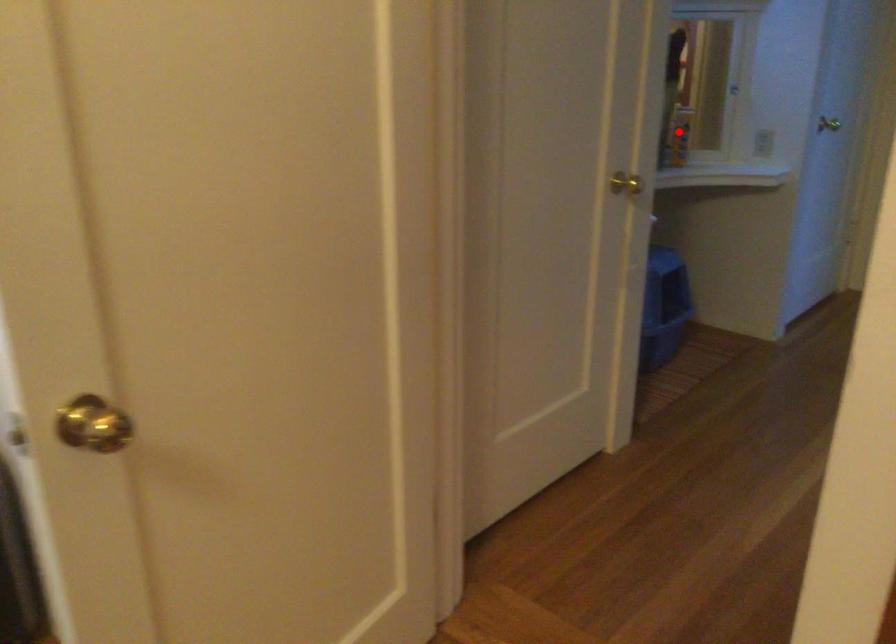
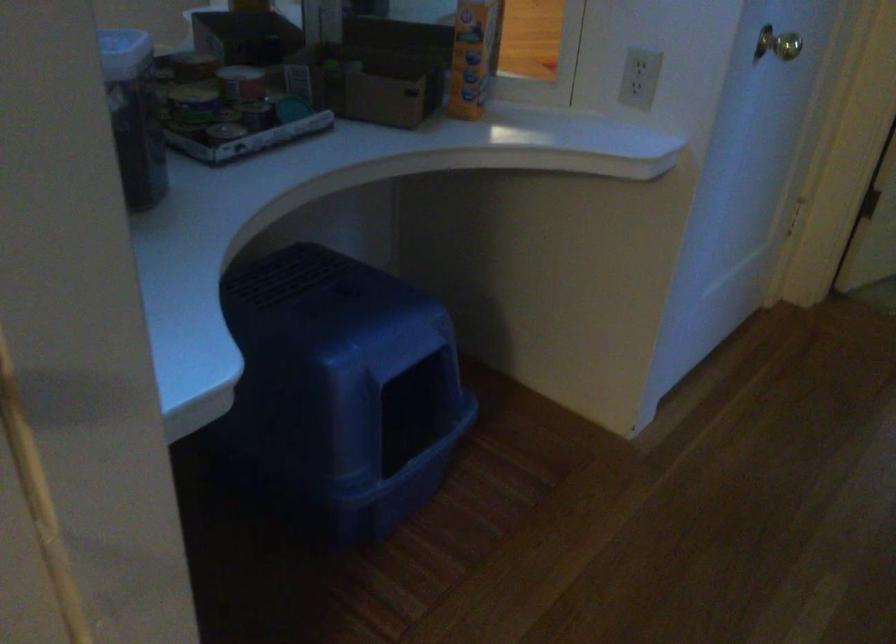
Locate, in the second image, the point that corresponds to the highlighted location in the first image.

(472, 57)